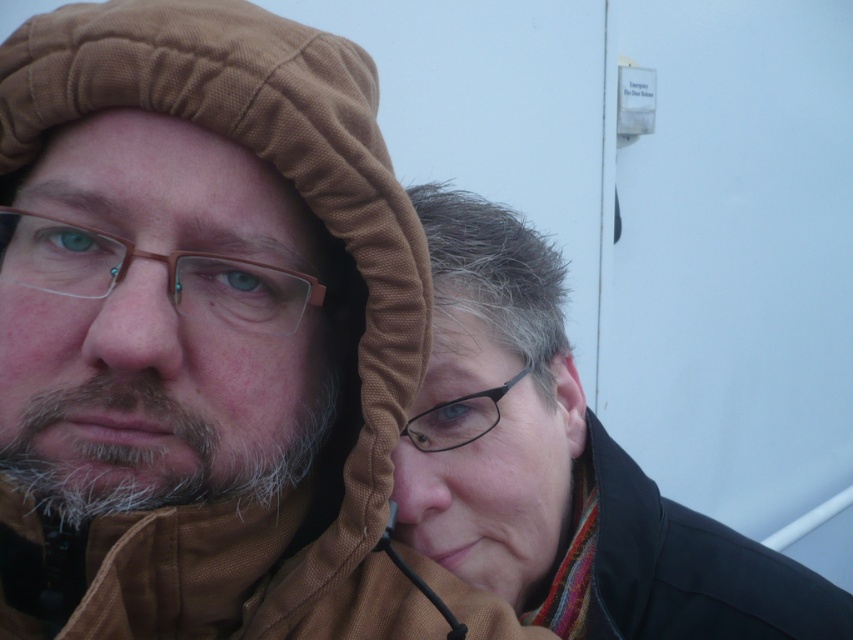
Is matte black jacket at center shorter than clear plastic glasses at center?

No.

Image resolution: width=853 pixels, height=640 pixels. I want to click on matte black jacket at center, so click(561, 467).

Who is positioned more to the right, clear plastic glasses at center or black plastic glasses at upper center?

black plastic glasses at upper center

Does clear plastic glasses at center have a greater height compared to black plastic glasses at upper center?

No.

Between point (270, 324) and point (462, 436), which one is positioned in front?

Point (270, 324) is in front.

Locate an element on the screen. Image resolution: width=853 pixels, height=640 pixels. clear plastic glasses at center is located at coordinates (160, 260).

Between brown quilted hood at upper left and black plastic glasses at upper center, which one is positioned higher?

Positioned higher is brown quilted hood at upper left.

Can you confirm if brown quilted hood at upper left is positioned to the right of black plastic glasses at upper center?

In fact, brown quilted hood at upper left is to the left of black plastic glasses at upper center.

Which is in front, point (212, 412) or point (459, 424)?

Positioned in front is point (212, 412).

Locate an element on the screen. This screenshot has height=640, width=853. brown quilted hood at upper left is located at coordinates (200, 330).